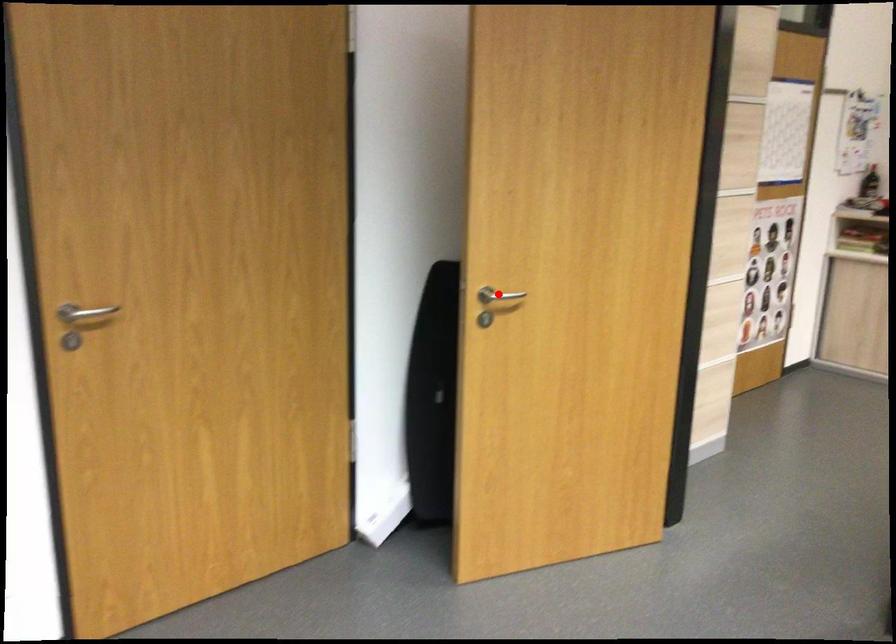
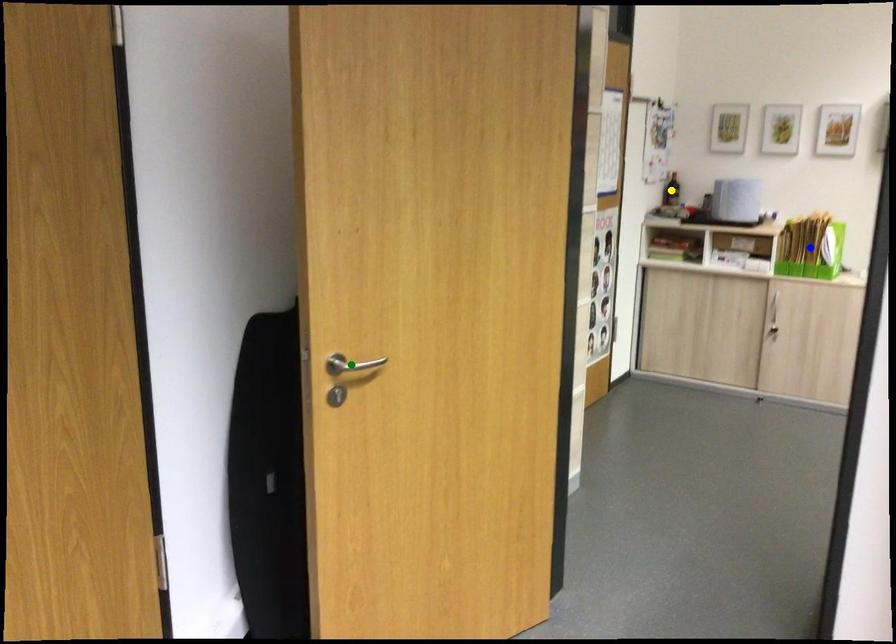
Question: I am providing you with two images of the same scene from different viewpoints. A red point is marked on the first image. You are given multiple points on the second image. In image 2, which mark is for the same physical point as the one in image 1?

Choices:
 (A) yellow point
 (B) blue point
 (C) green point

Answer: (C)